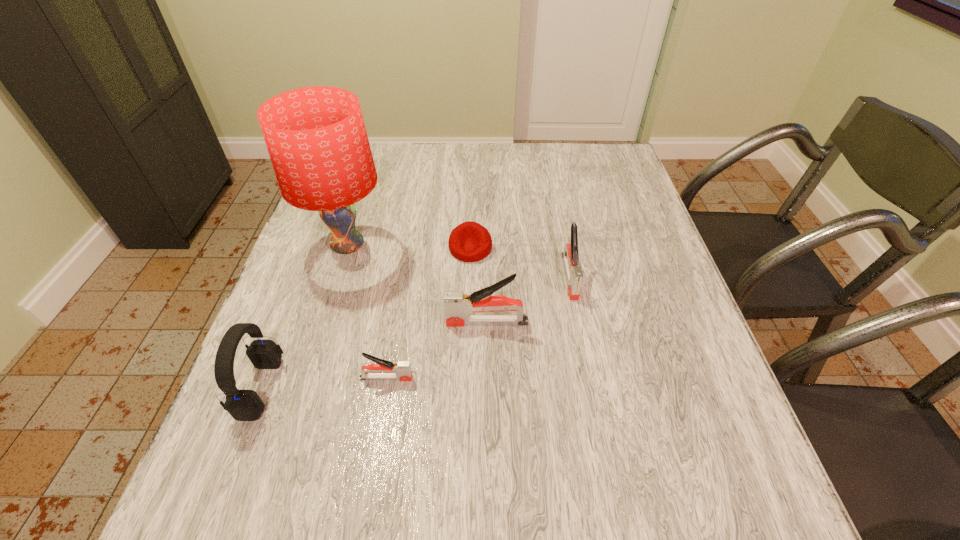
At what (x,y) coordinates should I click in order to perform the action: click on free spot located 0.320m on the handle side of the second stapler from left to right. Please return your answer as a coordinate pair (x, y). The image size is (960, 540). Looking at the image, I should click on (298, 322).

This screenshot has width=960, height=540. In order to click on vacant space located 0.320m on the handle side of the second stapler from left to right in this screenshot , I will do `click(298, 322)`.

Identify the location of free space located on the handle side of the second stapler from left to right. This screenshot has height=540, width=960. (376, 322).

Where is `free point located 0.220m on the handle side of the farthest stapler`? This screenshot has height=540, width=960. free point located 0.220m on the handle side of the farthest stapler is located at coordinates (591, 388).

Locate an element on the screen. The width and height of the screenshot is (960, 540). vacant region located 0.260m on the front-facing side of the tallest object is located at coordinates (492, 245).

This screenshot has width=960, height=540. I want to click on vacant space positioned on the seat area of the shortest object, so click(x=468, y=314).

Where is `vacant space situated 0.200m on the headband of the headset`? vacant space situated 0.200m on the headband of the headset is located at coordinates (384, 388).

At what (x,y) coordinates should I click in order to perform the action: click on object that is at the near edge. Please return your answer as a coordinate pair (x, y). This screenshot has width=960, height=540. Looking at the image, I should click on click(x=243, y=405).

You are a GUI agent. You are given a task and a screenshot of the screen. Output one action in this format:
    pyautogui.click(x=<x>, y=<y>)
    Task: Click on the lampshade that is at the left edge
    
    Given the screenshot: What is the action you would take?
    pyautogui.click(x=316, y=138)

At what (x,y) coordinates should I click in order to perform the action: click on headset located at the left edge. Please return your answer as a coordinate pair (x, y). The height and width of the screenshot is (540, 960). Looking at the image, I should click on (243, 405).